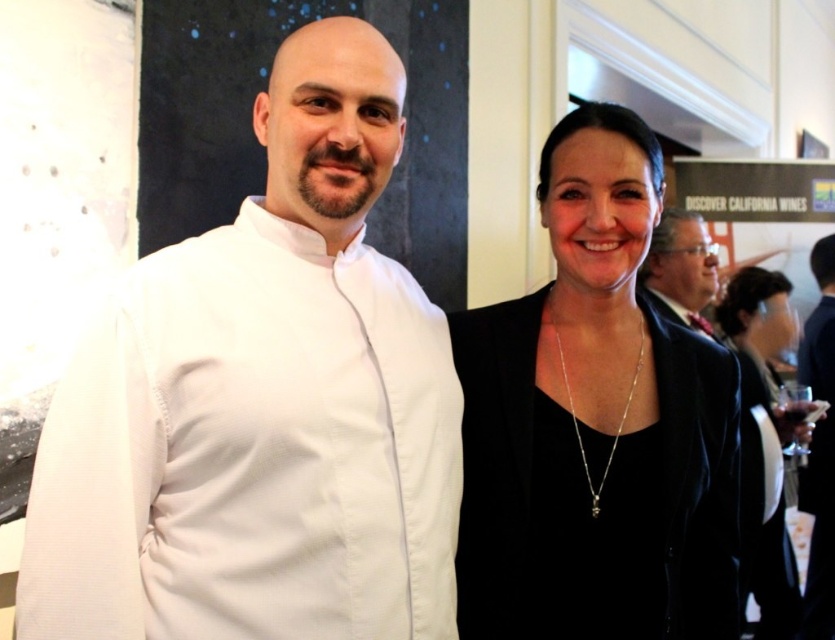
Question: Considering the real-world distances, which object is closest to the white smooth chef coat at left?

Choices:
 (A) black matte wine glass at right
 (B) transparent glass at right
 (C) black matte blazer at upper right
 (D) black velvet dress at right

Answer: (C)

Question: Is black matte blazer at upper right behind transparent glass at right?

Choices:
 (A) no
 (B) yes

Answer: (A)

Question: Considering the real-world distances, which object is farthest from the black velvet dress at right?

Choices:
 (A) black matte blazer at upper right
 (B) transparent glass at right
 (C) black matte wine glass at right

Answer: (A)

Question: Is white smooth chef coat at left thinner than black matte blazer at upper right?

Choices:
 (A) yes
 (B) no

Answer: (B)

Question: Estimate the real-world distances between objects in this image. Which object is farther from the black matte wine glass at right?

Choices:
 (A) black velvet dress at right
 (B) white smooth chef coat at left

Answer: (B)

Question: Is black matte blazer at upper right wider than black velvet dress at right?

Choices:
 (A) no
 (B) yes

Answer: (A)